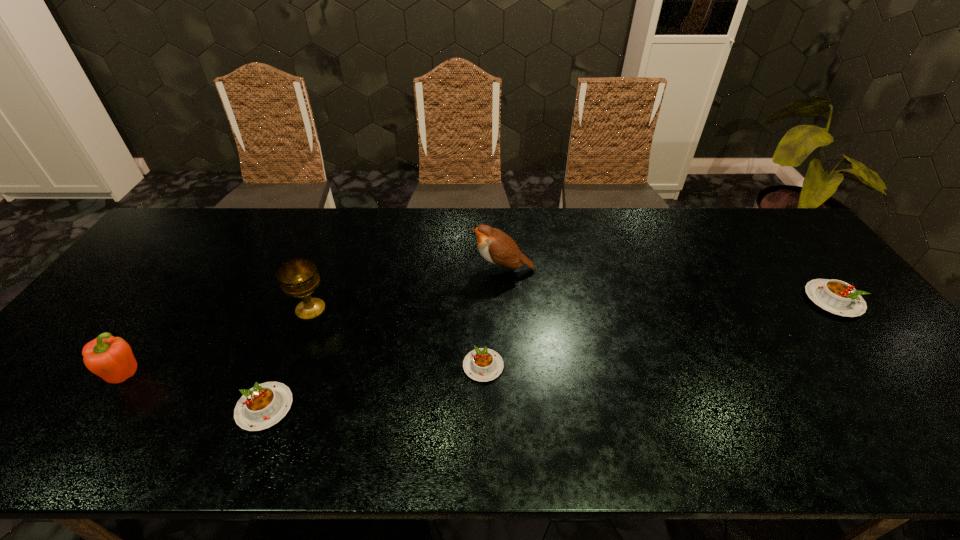
At what (x,y) coordinates should I click in order to perform the action: click on vacant point located between the bird and the pepper. Please return your answer as a coordinate pair (x, y). The height and width of the screenshot is (540, 960). Looking at the image, I should click on (314, 323).

Where is `vacant area that lies between the shortest object and the fifth tallest object`? The height and width of the screenshot is (540, 960). vacant area that lies between the shortest object and the fifth tallest object is located at coordinates (374, 387).

Where is `free space between the second shortest object and the bird`? The image size is (960, 540). free space between the second shortest object and the bird is located at coordinates (384, 339).

You are a GUI agent. You are given a task and a screenshot of the screen. Output one action in this format:
    pyautogui.click(x=<x>, y=<y>)
    Task: Click on the vacant area between the pepper and the shortest pudding
    
    Given the screenshot: What is the action you would take?
    pyautogui.click(x=304, y=372)

The height and width of the screenshot is (540, 960). I want to click on unoccupied position between the bird and the shortest pudding, so click(x=492, y=318).

Identify which object is the fifth closest to the bird. Please provide its 2D coordinates. Your answer should be formatted as a tuple, i.e. [(x, y)], where the tuple contains the x and y coordinates of a point satisfying the conditions above.

[(111, 358)]

I want to click on object that stands as the fourth closest to the rightmost object, so click(264, 405).

Select which pudding is the closest to the third shortest object. Please provide its 2D coordinates. Your answer should be formatted as a tuple, i.e. [(x, y)], where the tuple contains the x and y coordinates of a point satisfying the conditions above.

[(482, 364)]

Select which pudding appears as the closest to the pepper. Please provide its 2D coordinates. Your answer should be formatted as a tuple, i.e. [(x, y)], where the tuple contains the x and y coordinates of a point satisfying the conditions above.

[(264, 405)]

You are a GUI agent. You are given a task and a screenshot of the screen. Output one action in this format:
    pyautogui.click(x=<x>, y=<y>)
    Task: Click on the free location that satisfies the following two spatial constraints: 1. at the face of the bird; 2. on the front side of the chalice
    The height and width of the screenshot is (540, 960).
    Given the screenshot: What is the action you would take?
    pyautogui.click(x=505, y=309)